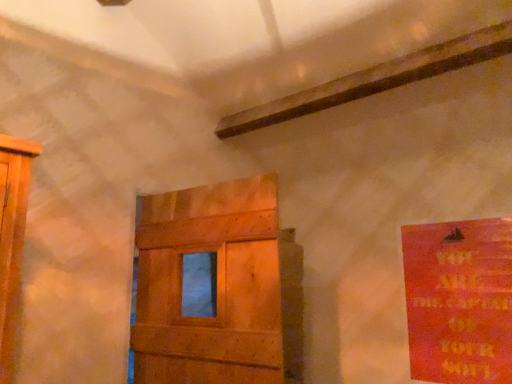
Question: Is red matte poster at right positioned before wooden door at center?

Choices:
 (A) yes
 (B) no

Answer: (B)

Question: Can you confirm if red matte poster at right is wider than wooden door at center?

Choices:
 (A) no
 (B) yes

Answer: (A)

Question: Is red matte poster at right facing away from wooden door at center?

Choices:
 (A) no
 (B) yes

Answer: (A)

Question: Is wooden door at center completely or partially inside red matte poster at right?

Choices:
 (A) yes
 (B) no

Answer: (B)

Question: Considering the relative sizes of red matte poster at right and wooden door at center in the image provided, is red matte poster at right shorter than wooden door at center?

Choices:
 (A) yes
 (B) no

Answer: (A)

Question: Does red matte poster at right have a greater height compared to wooden door at center?

Choices:
 (A) yes
 (B) no

Answer: (B)

Question: Is wooden door at center with red matte poster at right?

Choices:
 (A) yes
 (B) no

Answer: (B)

Question: Considering the relative sizes of wooden door at center and red matte poster at right in the image provided, is wooden door at center wider than red matte poster at right?

Choices:
 (A) yes
 (B) no

Answer: (A)

Question: Could you tell me if wooden door at center is turned towards red matte poster at right?

Choices:
 (A) yes
 (B) no

Answer: (B)

Question: Is wooden door at center shorter than red matte poster at right?

Choices:
 (A) yes
 (B) no

Answer: (B)

Question: Considering the relative sizes of wooden door at center and red matte poster at right in the image provided, is wooden door at center bigger than red matte poster at right?

Choices:
 (A) yes
 (B) no

Answer: (A)

Question: Is wooden door at center facing away from red matte poster at right?

Choices:
 (A) yes
 (B) no

Answer: (B)

Question: Considering the positions of red matte poster at right and wooden door at center in the image, is red matte poster at right taller or shorter than wooden door at center?

Choices:
 (A) tall
 (B) short

Answer: (B)